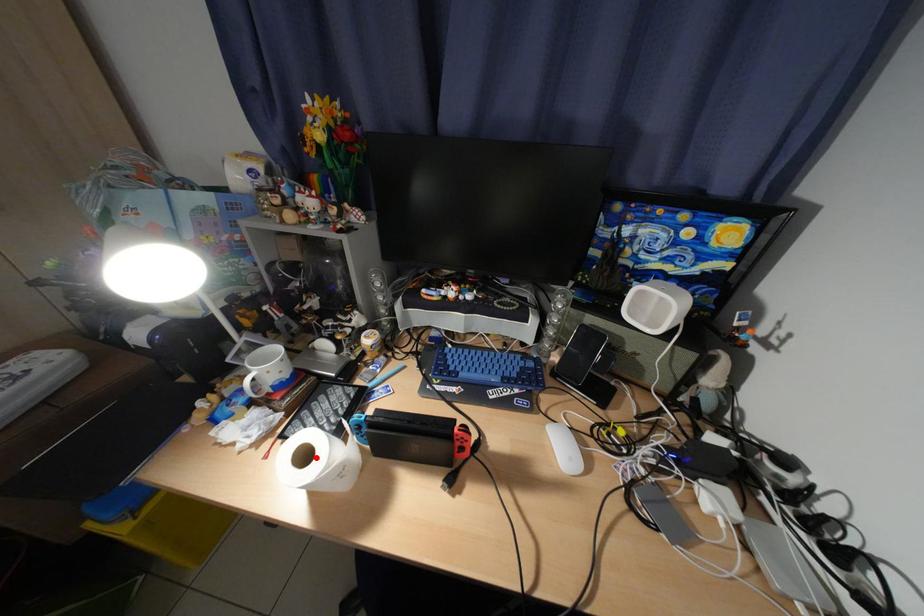
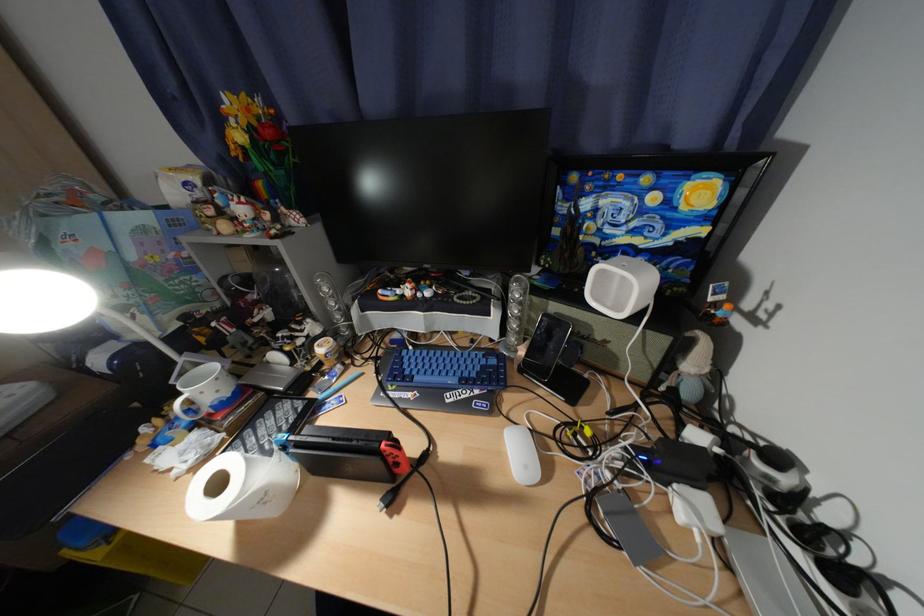
The point at the highlighted location is marked in the first image. Where is the corresponding point in the second image?

(229, 485)